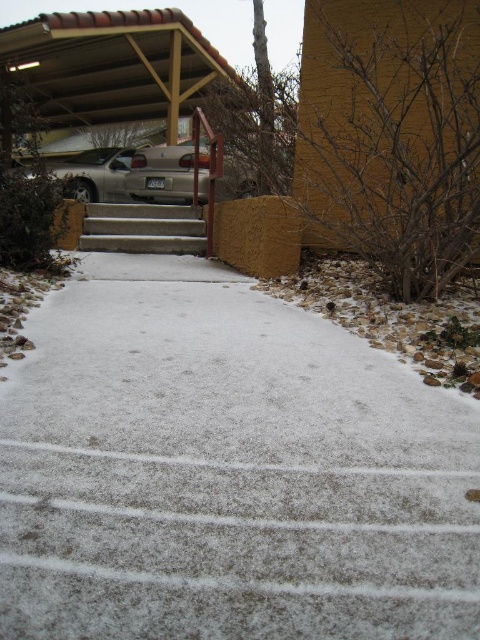
Does point (80, 378) come farther from viewer compared to point (172, 198)?

No.

Which is behind, point (336, 605) or point (189, 156)?

Point (189, 156)

Find the location of a particular element. Image resolution: width=480 pixels, height=640 pixels. white concrete steps at center is located at coordinates (227, 472).

Which is in front, point (163, 208) or point (97, 148)?

Point (163, 208) is more forward.

Who is shorter, concrete stairs at center or satin silver car at upper left?

With less height is concrete stairs at center.

Which is in front, point (142, 225) or point (85, 176)?

Positioned in front is point (142, 225).

The image size is (480, 640). What are the coordinates of `concrete stairs at center` in the screenshot? It's located at click(x=143, y=228).

Can you confirm if concrete stairs at center is bigger than silver metallic sedan at center?

A: No.

Can you confirm if concrete stairs at center is positioned to the right of silver metallic sedan at center?

No, concrete stairs at center is not to the right of silver metallic sedan at center.

The image size is (480, 640). I want to click on concrete stairs at center, so click(143, 228).